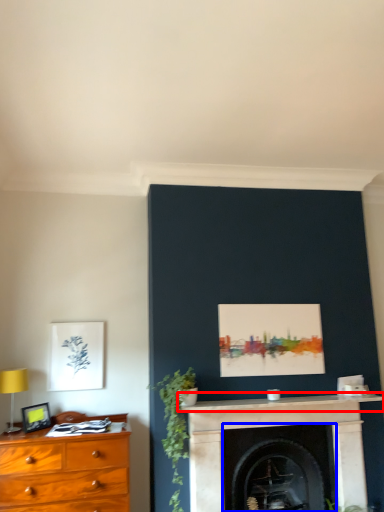
Question: Which object is further to the camera taking this photo, mantle (highlighted by a red box) or fireplace (highlighted by a blue box)?

Choices:
 (A) mantle
 (B) fireplace

Answer: (B)